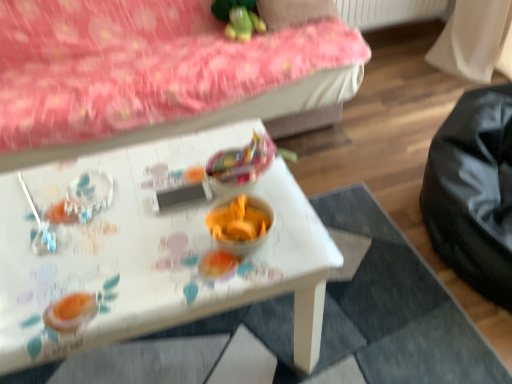
The height and width of the screenshot is (384, 512). What do you see at coordinates (242, 161) in the screenshot?
I see `shiny plastic candy at center` at bounding box center [242, 161].

Where is `green plush toy at upper center`? The height and width of the screenshot is (384, 512). green plush toy at upper center is located at coordinates (238, 18).

I want to click on pink fabric bed frame at upper left, so click(x=140, y=65).

Considering the positions of point (259, 168) and point (65, 278), is point (259, 168) closer or farther from the camera than point (65, 278)?

Point (259, 168) appears to be farther away from the viewer than point (65, 278).

From the image's perspective, is shiny plastic candy at center positioned above or below white glossy table at center?

shiny plastic candy at center is above white glossy table at center.

Is shiny plastic candy at center facing towards white glossy table at center?

No, shiny plastic candy at center does not turn towards white glossy table at center.

Between pink fabric pillow at upper center and shiny plastic candy at center, which one has larger size?

pink fabric pillow at upper center.

Are pink fabric pillow at upper center and shiny plastic candy at center far apart?

No.

How different are the orientations of pink fabric pillow at upper center and shiny plastic candy at center in degrees?

They differ by 94.3 degrees in their facing directions.

From a real-world perspective, does green plush toy at upper center stand above white glossy table at center?

Yes.

Consider the image. Is green plush toy at upper center next to white glossy table at center?

No.

Can white glossy table at center be found inside green plush toy at upper center?

Actually, white glossy table at center is outside green plush toy at upper center.

Is green plush toy at upper center at the left side of pink fabric bed frame at upper left?

In fact, green plush toy at upper center is to the right of pink fabric bed frame at upper left.

Which is less distant, [224,14] or [80,80]?

The point [80,80] is in front.

Can you see green plush toy at upper center touching pink fabric bed frame at upper left?

green plush toy at upper center and pink fabric bed frame at upper left are not in contact.

This screenshot has width=512, height=384. What are the coordinates of `bed frame that appears below the green plush toy at upper center (from a real-world perspective)` in the screenshot? It's located at (140, 65).

Between pink fabric bed frame at upper left and white glossy table at center, which one is positioned behind?

pink fabric bed frame at upper left is more distant.

Considering the points (233, 96) and (178, 302), which point is in front, point (233, 96) or point (178, 302)?

The point (178, 302) is closer.

Considering the relative sizes of pink fabric bed frame at upper left and white glossy table at center in the image provided, is pink fabric bed frame at upper left bigger than white glossy table at center?

Yes, pink fabric bed frame at upper left is bigger than white glossy table at center.

Is white glossy table at center completely or partially inside pink fabric bed frame at upper left?

Actually, white glossy table at center is outside pink fabric bed frame at upper left.

Can you confirm if green plush toy at upper center is taller than pink fabric pillow at upper center?

Yes, green plush toy at upper center is taller than pink fabric pillow at upper center.

Looking at this image, would you consider green plush toy at upper center to be distant from pink fabric pillow at upper center?

Actually, green plush toy at upper center and pink fabric pillow at upper center are a little close together.

Does green plush toy at upper center appear on the left side of pink fabric pillow at upper center?

Indeed, green plush toy at upper center is positioned on the left side of pink fabric pillow at upper center.

Where is `toy below the pink fabric pillow at upper center (from the image's perspective)`? The height and width of the screenshot is (384, 512). toy below the pink fabric pillow at upper center (from the image's perspective) is located at coordinates (238, 18).

Is pink fabric pillow at upper center surrounding white glossy table at center?

No, white glossy table at center is not surrounded by pink fabric pillow at upper center.

From a real-world perspective, who is located lower, pink fabric pillow at upper center or white glossy table at center?

In real-world perspective, white glossy table at center is lower.

Who is taller, pink fabric pillow at upper center or white glossy table at center?

white glossy table at center is taller.

Would you say pink fabric pillow at upper center is to the left or to the right of white glossy table at center in the picture?

pink fabric pillow at upper center is to the right of white glossy table at center.

Find the location of a particular element. Image resolution: width=512 pixels, height=384 pixels. table that is in front of the shiny plastic candy at center is located at coordinates (149, 254).

Locate an element on the screen. The width and height of the screenshot is (512, 384). pillow on the right of shiny plastic candy at center is located at coordinates (294, 12).

When comparing their distances from white glossy table at center, does green plush toy at upper center or pink fabric pillow at upper center seem closer?

The object closer to white glossy table at center is green plush toy at upper center.

Looking at the image, which one is located further to shiny plastic candy at center, pink fabric pillow at upper center or green plush toy at upper center?

Based on the image, pink fabric pillow at upper center appears to be further to shiny plastic candy at center.

Considering their positions, is green plush toy at upper center positioned further to white glossy table at center than shiny plastic candy at center?

Based on the image, green plush toy at upper center appears to be further to white glossy table at center.

Which object lies nearer to the anchor point pink fabric pillow at upper center, white glossy table at center or pink fabric bed frame at upper left?

pink fabric bed frame at upper left is closer to pink fabric pillow at upper center.

Which object lies nearer to the anchor point white glossy table at center, shiny plastic candy at center or green plush toy at upper center?

shiny plastic candy at center is closer to white glossy table at center.

In the scene shown: Which object lies further to the anchor point pink fabric pillow at upper center, white glossy table at center or shiny plastic candy at center?

Based on the image, white glossy table at center appears to be further to pink fabric pillow at upper center.

Which object lies nearer to the anchor point pink fabric bed frame at upper left, shiny plastic candy at center or pink fabric pillow at upper center?

The object closer to pink fabric bed frame at upper left is pink fabric pillow at upper center.

In the scene shown: Which object lies nearer to the anchor point shiny plastic candy at center, pink fabric pillow at upper center or white glossy table at center?

white glossy table at center is closer to shiny plastic candy at center.

Where is `toy between pink fabric bed frame at upper left and pink fabric pillow at upper center along the z-axis`? The image size is (512, 384). toy between pink fabric bed frame at upper left and pink fabric pillow at upper center along the z-axis is located at coordinates (238, 18).

The width and height of the screenshot is (512, 384). Find the location of `food between green plush toy at upper center and white glossy table at center from top to bottom`. food between green plush toy at upper center and white glossy table at center from top to bottom is located at coordinates (242, 161).

Identify the location of toy that lies between pink fabric pillow at upper center and shiny plastic candy at center from top to bottom. (238, 18).

Find the location of a particular element. Image resolution: width=512 pixels, height=384 pixels. food between pink fabric pillow at upper center and white glossy table at center from top to bottom is located at coordinates (242, 161).